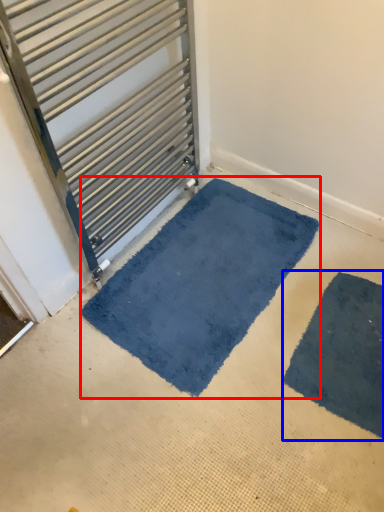
Question: Among these objects, which one is nearest to the camera, mat (highlighted by a red box) or bath mat (highlighted by a blue box)?

Choices:
 (A) mat
 (B) bath mat

Answer: (B)